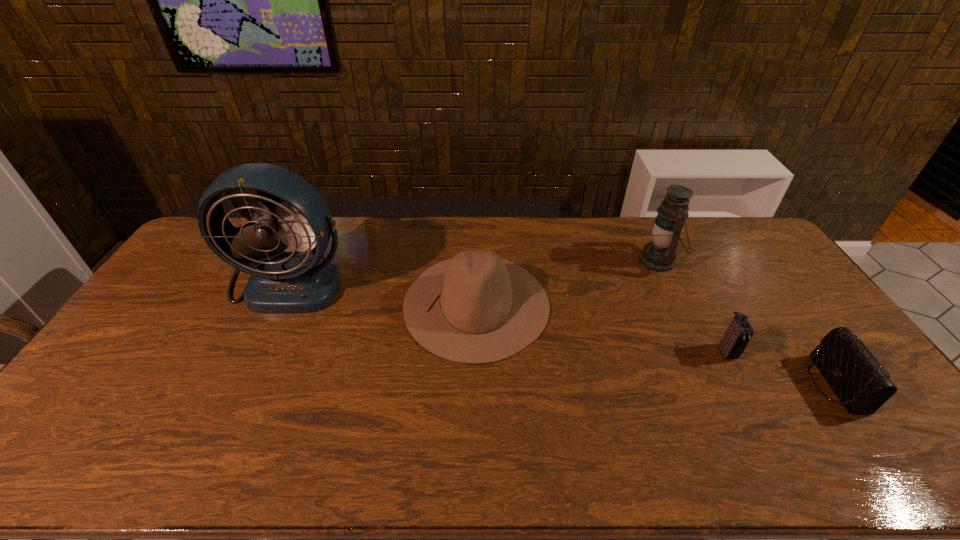
The height and width of the screenshot is (540, 960). Find the location of `fan`. fan is located at coordinates (288, 211).

This screenshot has width=960, height=540. I want to click on the tallest object, so click(288, 211).

The height and width of the screenshot is (540, 960). What are the coordinates of `oil lamp` in the screenshot? It's located at (659, 255).

The width and height of the screenshot is (960, 540). Find the location of `the third shortest object`. the third shortest object is located at coordinates tap(475, 308).

Locate an element on the screen. The height and width of the screenshot is (540, 960). sombrero is located at coordinates (475, 308).

Image resolution: width=960 pixels, height=540 pixels. I want to click on the left clutch bag, so click(734, 341).

Image resolution: width=960 pixels, height=540 pixels. In order to click on the rightmost object in this screenshot , I will do `click(861, 385)`.

Find the location of a particular element. free space located 0.340m in front of the leftmost object to blow air is located at coordinates (230, 412).

The width and height of the screenshot is (960, 540). In order to click on free space located on the front of the fourth shortest object in this screenshot , I will do `click(714, 378)`.

Where is `free space located 0.400m on the left of the third tallest object`? This screenshot has height=540, width=960. free space located 0.400m on the left of the third tallest object is located at coordinates (277, 304).